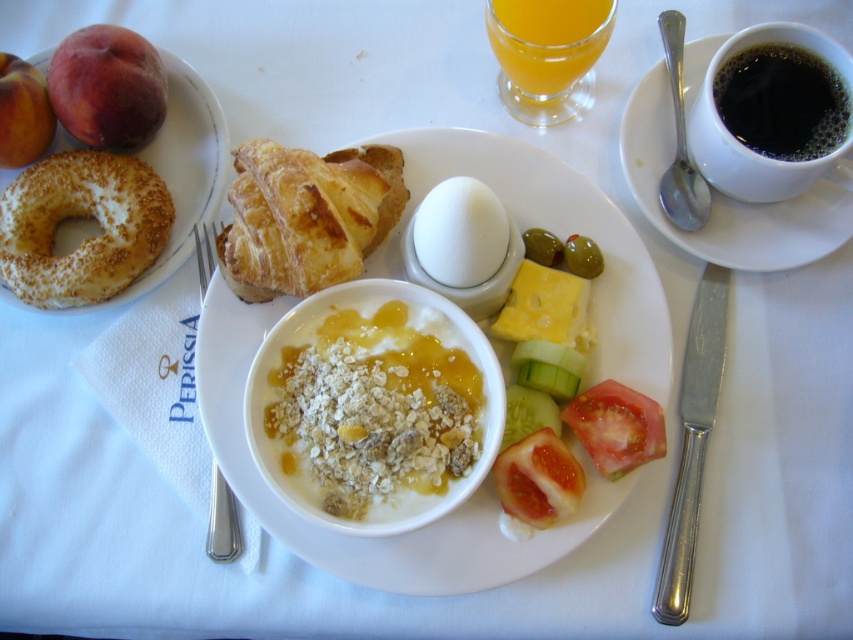
You are a food delivery person who needs to place a small note on the table. You want to put it near the slightly toasted bagel at upper left. Where should you place the note on the table?

The slightly toasted bagel at upper left is located at point (x=173, y=177). You should place the note near that coordinate.

From the picture: You are a food critic sitting at the table. You want to grab the juicy red tomato at lower right but need to reach past the golden brown flaky croissant at center. Is the croissant blocking your path to the tomato?

The golden brown flaky croissant at center is in front of the juicy red tomato at lower right, so it is blocking the path to the tomato.

You are a delivery robot with a camera that has a focal length of 24 mm. You need to place a small item exactly at the point marked as point (231, 237). The distance from your camera to the table is 31.28 inches. Can you confirm if the point is within the camera view?

The point (231, 237) is 31.28 inches away from the camera, which is within the camera view since the distance matches the required placement. Yes, the point is within the camera view.